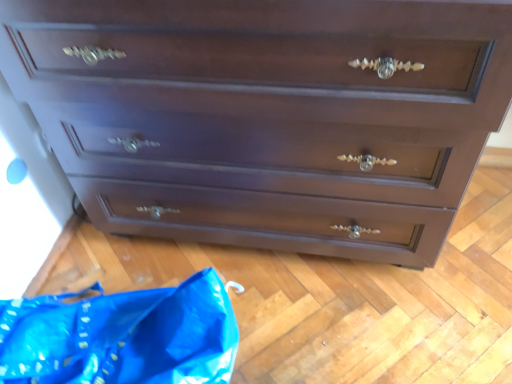
Question: From the image's perspective, relative to dark wood chest of drawers at center, is blue plastic bag at lower left above or below?

Choices:
 (A) below
 (B) above

Answer: (A)

Question: Considering the relative positions of blue plastic bag at lower left and dark wood chest of drawers at center in the image provided, is blue plastic bag at lower left to the left or to the right of dark wood chest of drawers at center?

Choices:
 (A) left
 (B) right

Answer: (A)

Question: Considering the positions of blue plastic bag at lower left and dark wood chest of drawers at center in the image, is blue plastic bag at lower left bigger or smaller than dark wood chest of drawers at center?

Choices:
 (A) big
 (B) small

Answer: (B)

Question: Looking at their shapes, would you say dark wood chest of drawers at center is wider or thinner than blue plastic bag at lower left?

Choices:
 (A) wide
 (B) thin

Answer: (A)

Question: Do you think dark wood chest of drawers at center is within blue plastic bag at lower left, or outside of it?

Choices:
 (A) outside
 (B) inside

Answer: (A)

Question: From the image's perspective, is dark wood chest of drawers at center positioned above or below blue plastic bag at lower left?

Choices:
 (A) above
 (B) below

Answer: (A)

Question: Looking at the image, does dark wood chest of drawers at center seem bigger or smaller compared to blue plastic bag at lower left?

Choices:
 (A) big
 (B) small

Answer: (A)